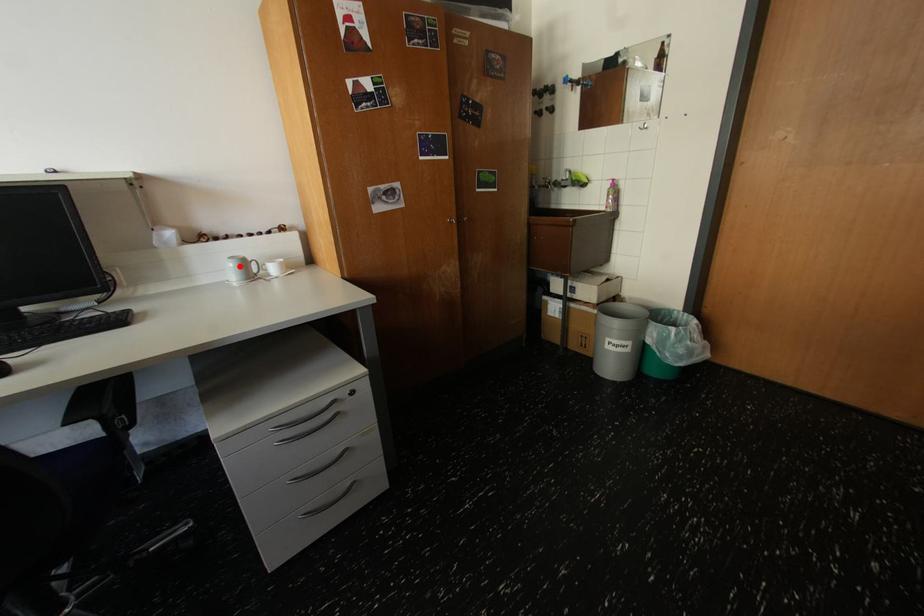
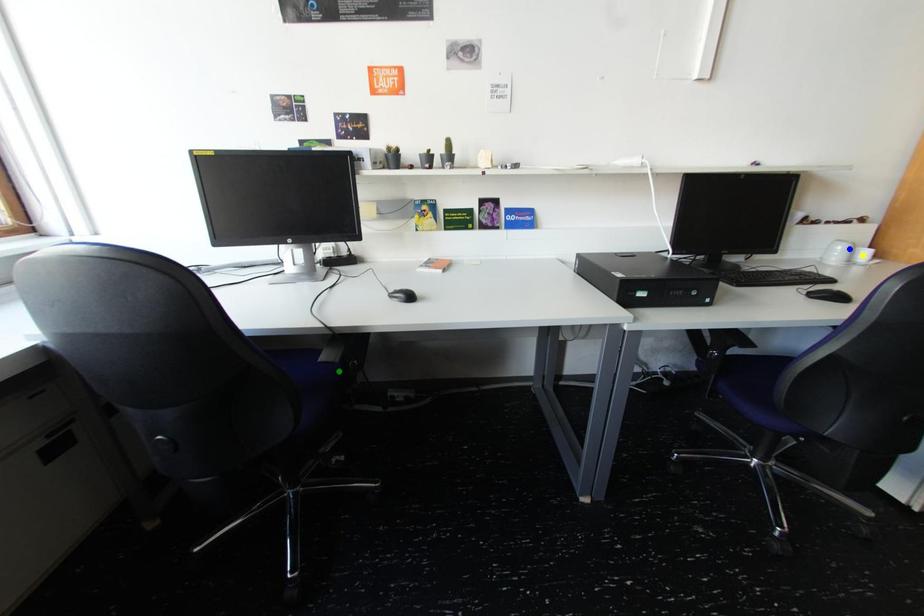
Question: I am providing you with two images of the same scene from different viewpoints. A red point is marked on the first image. You are given multiple points on the second image. Can you choose the point in image 2 that corresponds to the point in image 1?

Choices:
 (A) yellow point
 (B) green point
 (C) blue point

Answer: (C)